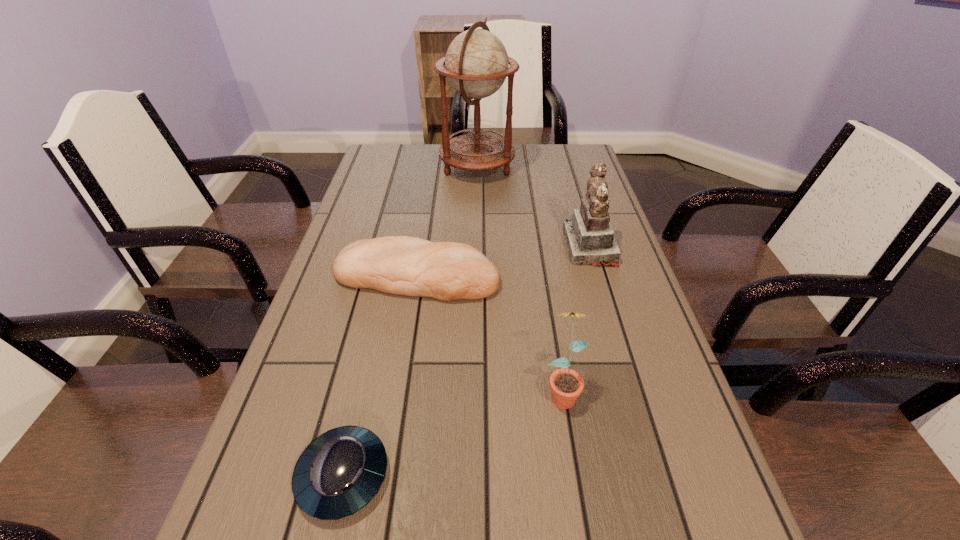
Image resolution: width=960 pixels, height=540 pixels. Identify the location of free spot at the left edge of the desktop. (336, 304).

Locate an element on the screen. The height and width of the screenshot is (540, 960). vacant area at the right edge of the desktop is located at coordinates (577, 297).

I want to click on free spot at the far left corner of the desktop, so click(x=395, y=150).

The width and height of the screenshot is (960, 540). Find the location of `vacant space that's between the rightmost object and the second shortest object`. vacant space that's between the rightmost object and the second shortest object is located at coordinates (503, 261).

The width and height of the screenshot is (960, 540). What are the coordinates of `blank region between the figurine and the globe` in the screenshot? It's located at (534, 206).

Where is `vacant area between the second nearest object and the rightmost object`? vacant area between the second nearest object and the rightmost object is located at coordinates (576, 319).

At what (x,y) coordinates should I click in order to perform the action: click on vacant area between the bread and the fourth object from left to right. Please return your answer as a coordinate pair (x, y). Image resolution: width=960 pixels, height=540 pixels. Looking at the image, I should click on (490, 333).

Where is `vacant area that lies between the tallest object and the fourth tallest object`? vacant area that lies between the tallest object and the fourth tallest object is located at coordinates click(x=447, y=221).

At what (x,y) coordinates should I click in order to perform the action: click on vacant point located between the third tallest object and the farthest object. Please return your answer as a coordinate pair (x, y). This screenshot has height=540, width=960. Looking at the image, I should click on (519, 278).

Locate an element on the screen. The height and width of the screenshot is (540, 960). vacant space that is in between the figurine and the sunflower is located at coordinates (576, 319).